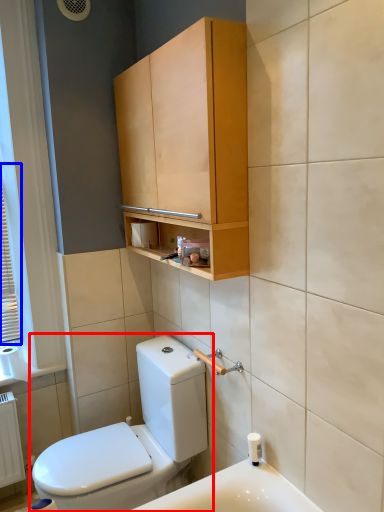
Question: Which object appears farthest to the camera in this image, toilet (highlighted by a red box) or window (highlighted by a blue box)?

Choices:
 (A) toilet
 (B) window

Answer: (B)